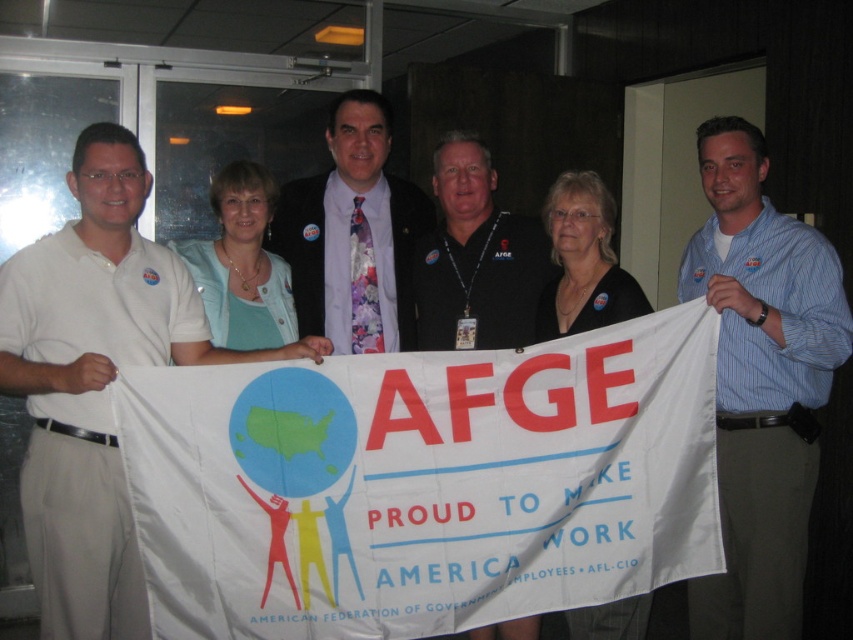
Question: Can you confirm if white fabric banner at center is positioned to the right of black fabric shirt at center?

Choices:
 (A) yes
 (B) no

Answer: (B)

Question: Does blue striped shirt at center lie behind black fabric shirt at center?

Choices:
 (A) no
 (B) yes

Answer: (A)

Question: Which object is positioned farthest from the white fabric banner at center?

Choices:
 (A) floral tie at center
 (B) black shirt at center

Answer: (A)

Question: Which point is closer to the camera?

Choices:
 (A) black shirt at center
 (B) black fabric shirt at center
 (C) white shirt at left

Answer: (C)

Question: Which of the following is the closest to the observer?

Choices:
 (A) (738, 244)
 (B) (450, 250)
 (C) (65, 317)

Answer: (C)

Question: Is the position of white fabric banner at center more distant than that of blue striped shirt at center?

Choices:
 (A) no
 (B) yes

Answer: (A)